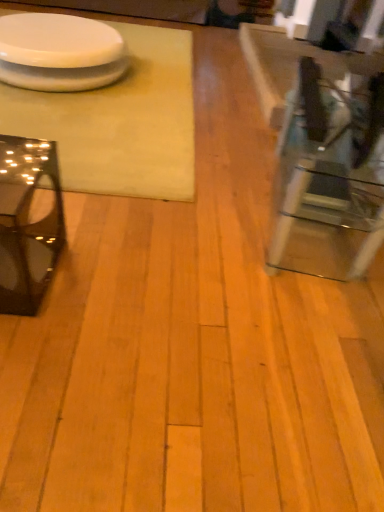
Where is `free space above clear glass table at right, which is the third table from left to right (from a real-world perspective)`? The width and height of the screenshot is (384, 512). free space above clear glass table at right, which is the third table from left to right (from a real-world perspective) is located at coordinates (334, 98).